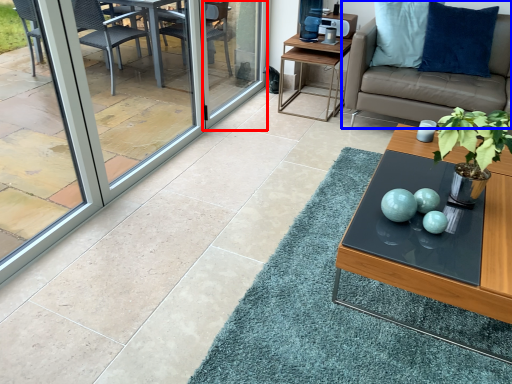
Question: Which point is further to the camera, screen door (highlighted by a red box) or studio couch (highlighted by a blue box)?

Choices:
 (A) screen door
 (B) studio couch

Answer: (A)